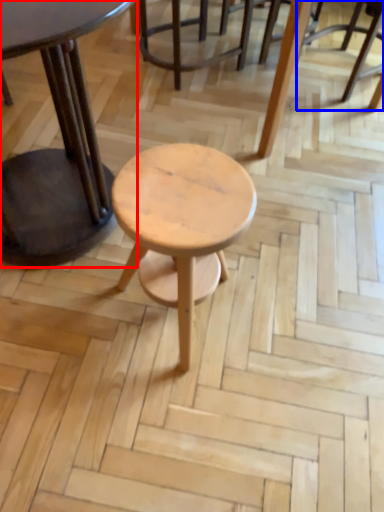
Question: Which of the following is the closest to the observer, table (highlighted by a red box) or chair (highlighted by a blue box)?

Choices:
 (A) table
 (B) chair

Answer: (A)